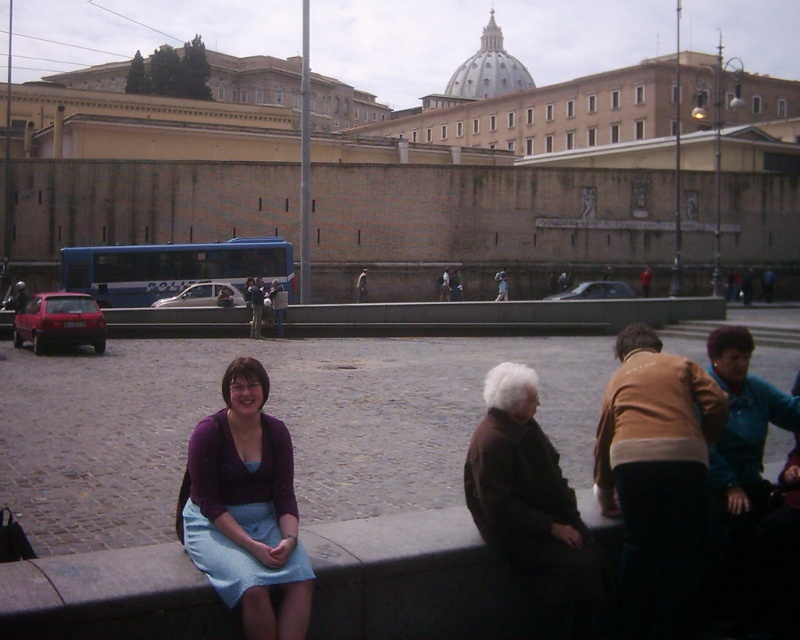
Question: Can you confirm if purple fabric skirt at lower left is positioned below brown woolen sweater at lower right?

Choices:
 (A) yes
 (B) no

Answer: (A)

Question: Is purple fabric skirt at lower left wider than brown woolen sweater at lower right?

Choices:
 (A) yes
 (B) no

Answer: (A)

Question: Is purple fabric skirt at lower left to the right of brown woolen sweater at lower right from the viewer's perspective?

Choices:
 (A) yes
 (B) no

Answer: (B)

Question: Which point appears farthest from the camera in this image?

Choices:
 (A) (234, 490)
 (B) (498, 374)

Answer: (B)